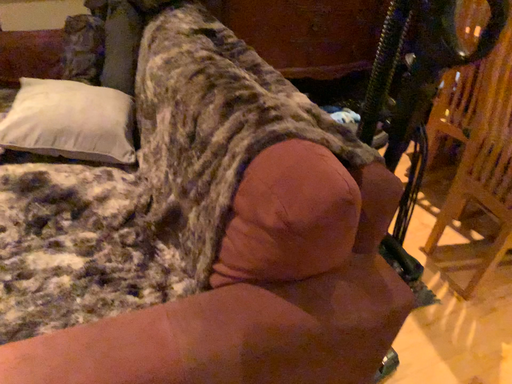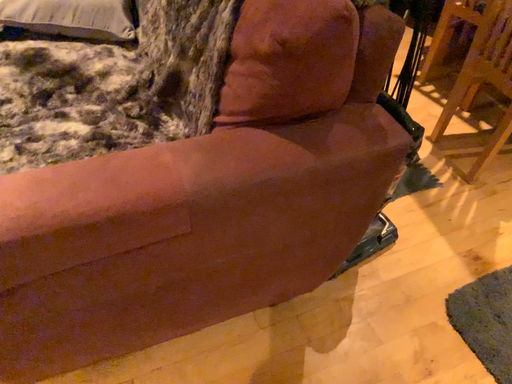
Question: How did the camera likely rotate when shooting the video?

Choices:
 (A) rotated upward
 (B) rotated downward

Answer: (B)